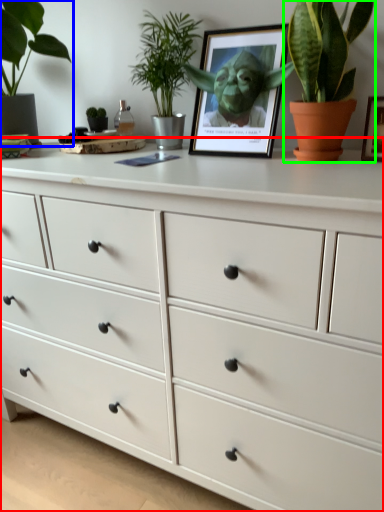
Question: Considering the real-world distances, which object is farthest from chest of drawers (highlighted by a red box)? houseplant (highlighted by a blue box) or houseplant (highlighted by a green box)?

Choices:
 (A) houseplant
 (B) houseplant

Answer: (A)